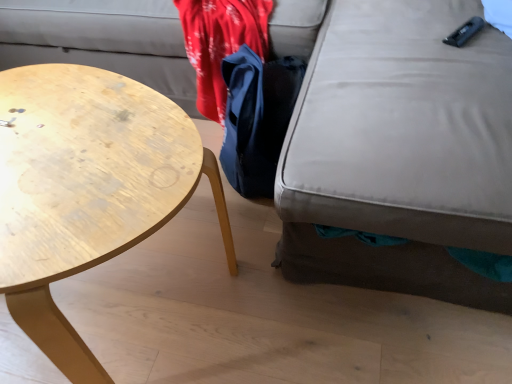
You are a GUI agent. You are given a task and a screenshot of the screen. Output one action in this format:
    pyautogui.click(x=<x>, y=<y>)
    Task: Click on the free space in front of blue fabric bag at center
    The width and height of the screenshot is (512, 384).
    Given the screenshot: What is the action you would take?
    pyautogui.click(x=234, y=238)